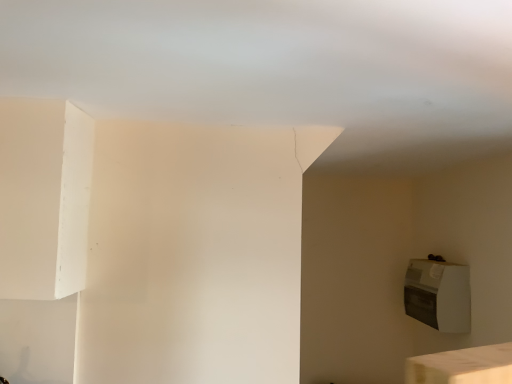
Identify the location of white matte water heater at upper right. (438, 295).

What do you see at coordinates (438, 295) in the screenshot? The width and height of the screenshot is (512, 384). I see `white matte water heater at upper right` at bounding box center [438, 295].

The image size is (512, 384). Find the location of `white matte water heater at upper right`. white matte water heater at upper right is located at coordinates (438, 295).